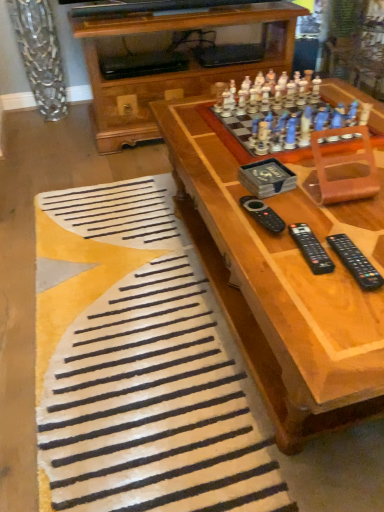
Find the location of a particular element. This screenshot has width=384, height=512. vacant area that lies to the right of black plastic remote at lower right, which ranks as the second remote in left-to-right order is located at coordinates (360, 234).